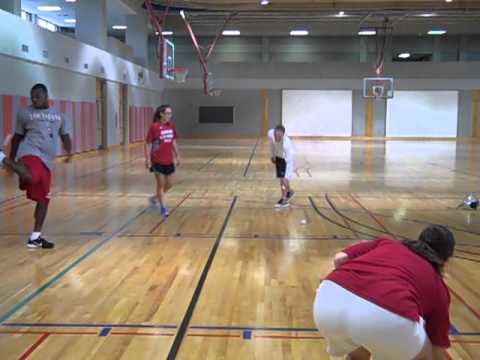
Identify the location of locker. (113, 108).